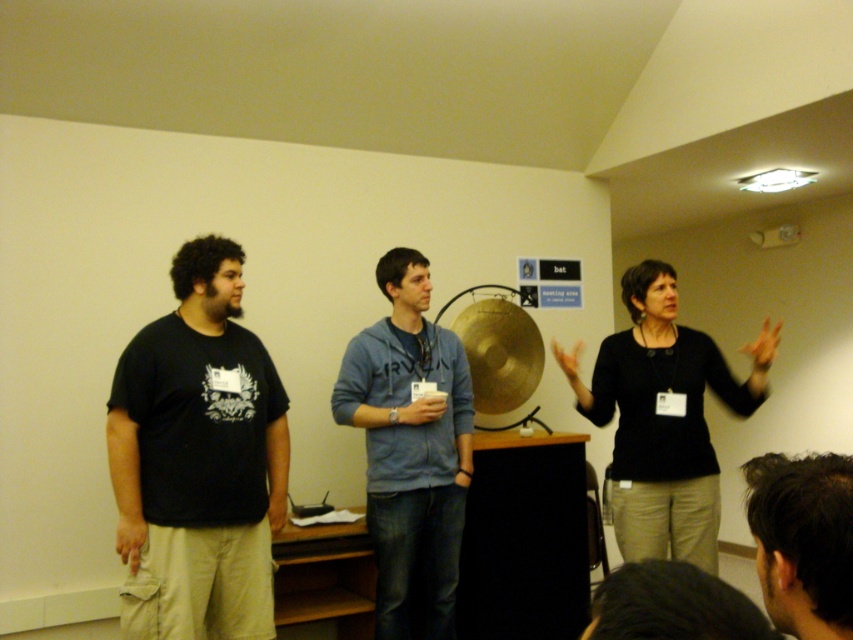
You are a photographer setting up for a concert. You need to position a spotlight on the black matte shirt at center and the gold metallic cymbal at center. According to the scene, which object should the spotlight be placed to the left of?

The spotlight should be placed to the left of the gold metallic cymbal at center because the black matte shirt at center is positioned to the right of it.

Based on the photo, you are standing in the room and want to locate the black matte shirt at center. According to the coordinates given, where would you find it?

The black matte shirt at center is located at the coordinates point (663, 419).